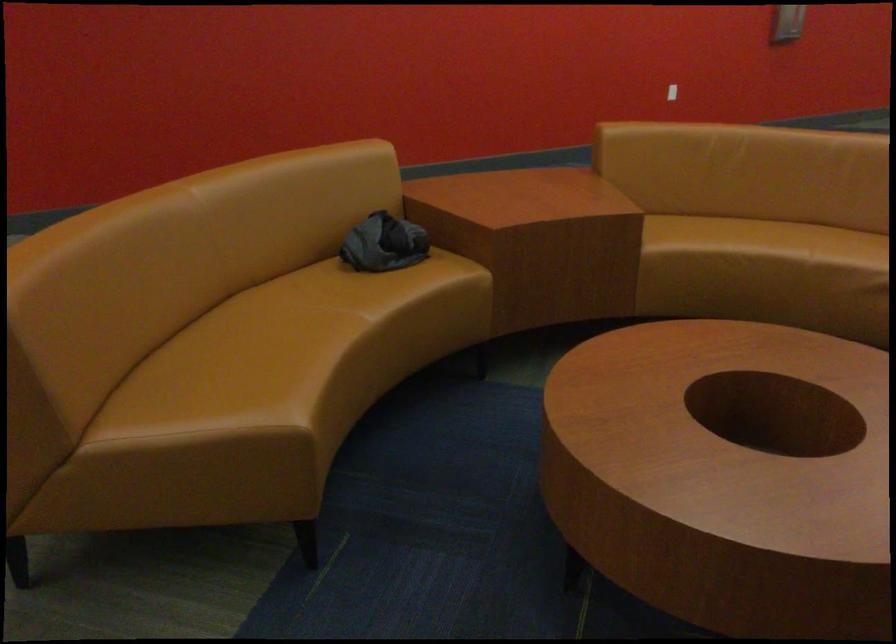
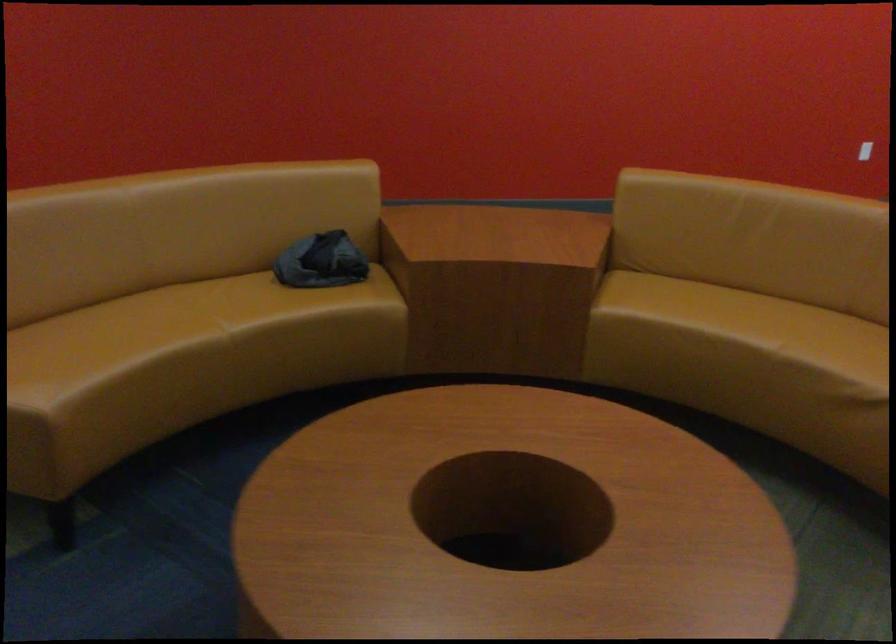
Question: The images are taken continuously from a first-person perspective. In which direction are you moving?

Choices:
 (A) Left
 (B) Right
 (C) Forward
 (D) Backward

Answer: (B)